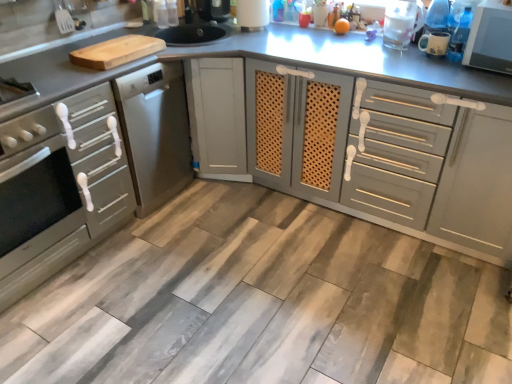
Question: From their relative heights in the image, would you say white glossy microwave at upper right is taller or shorter than matte gray cabinet at center, the second cabinetry when ordered from left to right?

Choices:
 (A) tall
 (B) short

Answer: (B)

Question: Considering the positions of white glossy microwave at upper right and matte gray cabinet at center, the second cabinetry when ordered from left to right, in the image, is white glossy microwave at upper right bigger or smaller than matte gray cabinet at center, the second cabinetry when ordered from left to right,?

Choices:
 (A) small
 (B) big

Answer: (A)

Question: Estimate the real-world distances between objects in this image. Which object is closer to the matte gray cabinet at center, the 1th cabinetry from the right?

Choices:
 (A) matte white mug at upper right, which is the first appliance in front-to-back order
 (B) matte gray oven at left, which is the first cabinetry in left-to-right order
 (C) white glossy microwave at upper right
 (D) satin silver oven at left
 (E) white textured paper towel holder at upper center, which ranks as the first appliance in left-to-right order

Answer: (C)

Question: Which is nearer to the matte white mug at upper right, which is the first appliance in front-to-back order?

Choices:
 (A) white glossy microwave at upper right
 (B) matte gray cabinet at center, the 1th cabinetry from the right
 (C) transparent plastic pitcher at upper right, the 2th appliance viewed from the back
 (D) white textured paper towel holder at upper center, the 3th appliance in the right-to-left sequence
 (E) matte gray oven at left, which appears as the second cabinetry when viewed from the right

Answer: (C)